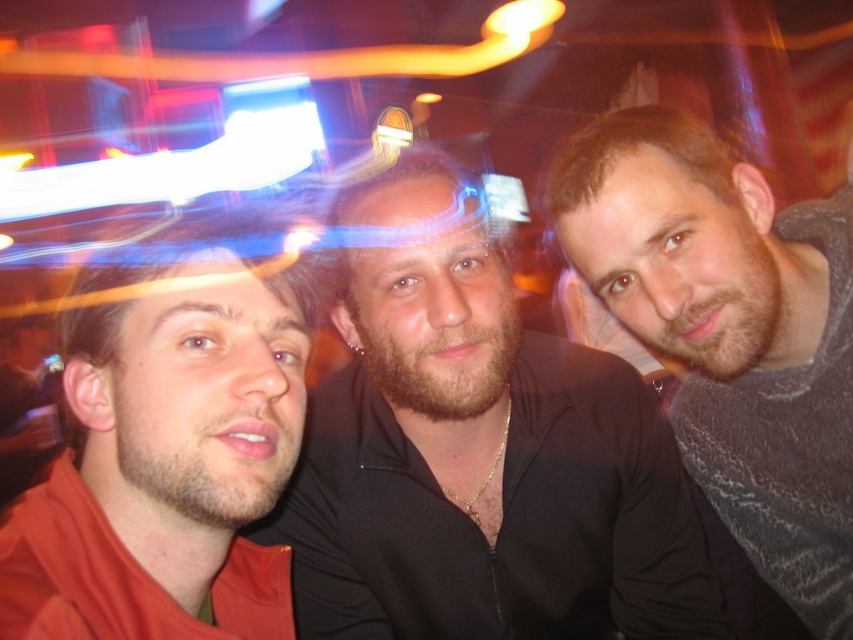
Can you confirm if matte orange shirt at left is wider than gray textured hoodie at right?

Incorrect, matte orange shirt at left's width does not surpass gray textured hoodie at right's.

In the scene shown: Which is more to the left, matte orange shirt at left or gray textured hoodie at right?

matte orange shirt at left

Is point (125, 484) positioned behind point (634, 266)?

No.

In order to click on matte orange shirt at left in this screenshot , I will do click(x=171, y=451).

Does smooth black shirt at center have a smaller size compared to matte orange shirt at left?

Actually, smooth black shirt at center might be larger than matte orange shirt at left.

Who is more distant from viewer, (341, 524) or (154, 497)?

Point (341, 524)

The width and height of the screenshot is (853, 640). What are the coordinates of `smooth black shirt at center` in the screenshot? It's located at (483, 472).

Can you confirm if smooth black shirt at center is smaller than gray textured hoodie at right?

Incorrect, smooth black shirt at center is not smaller in size than gray textured hoodie at right.

Between smooth black shirt at center and gray textured hoodie at right, which one appears on the right side from the viewer's perspective?

gray textured hoodie at right

Who is more forward, (x=506, y=557) or (x=762, y=552)?

Positioned in front is point (x=506, y=557).

Find the location of a particular element. This screenshot has height=640, width=853. smooth black shirt at center is located at coordinates (483, 472).